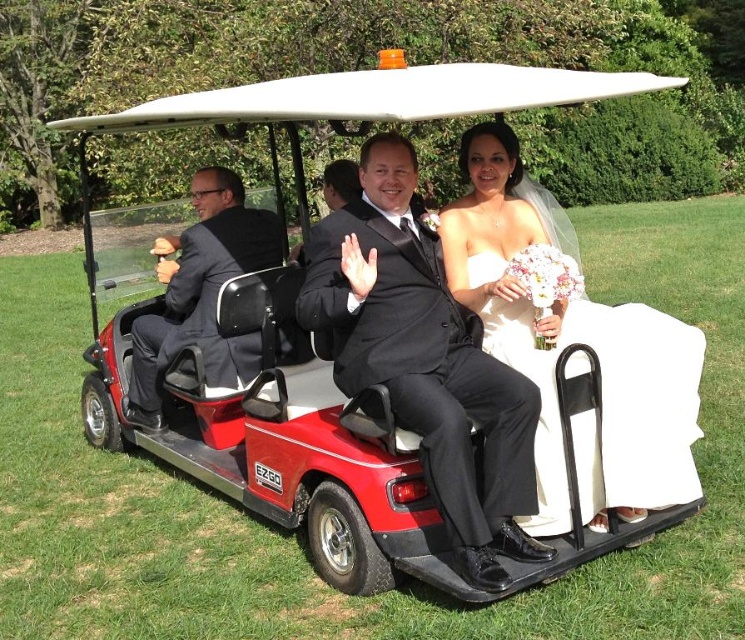
Question: Is the position of white satin dress at center more distant than that of matte black suit at left?

Choices:
 (A) yes
 (B) no

Answer: (B)

Question: Which object appears closest to the camera in this image?

Choices:
 (A) matte black suit at center
 (B) matte black suit at left
 (C) white satin dress at center

Answer: (A)

Question: Based on their relative distances, which object is farther from the matte black suit at left?

Choices:
 (A) matte black suit at center
 (B) white satin dress at center

Answer: (B)

Question: Can you confirm if matte black suit at center is positioned below white satin dress at center?

Choices:
 (A) no
 (B) yes

Answer: (B)

Question: Where is white satin dress at center located in relation to matte black suit at left in the image?

Choices:
 (A) above
 (B) below

Answer: (B)

Question: Estimate the real-world distances between objects in this image. Which object is closer to the matte black suit at left?

Choices:
 (A) matte black suit at center
 (B) white satin dress at center

Answer: (A)